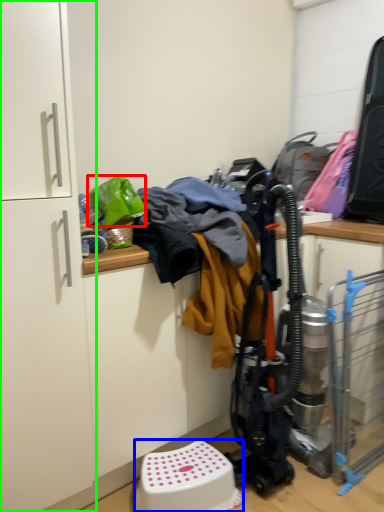
Question: Estimate the real-world distances between objects in this image. Which object is farther from clothing (highlighted by a red box), step stool (highlighted by a blue box) or cabinetry (highlighted by a green box)?

Choices:
 (A) step stool
 (B) cabinetry

Answer: (A)